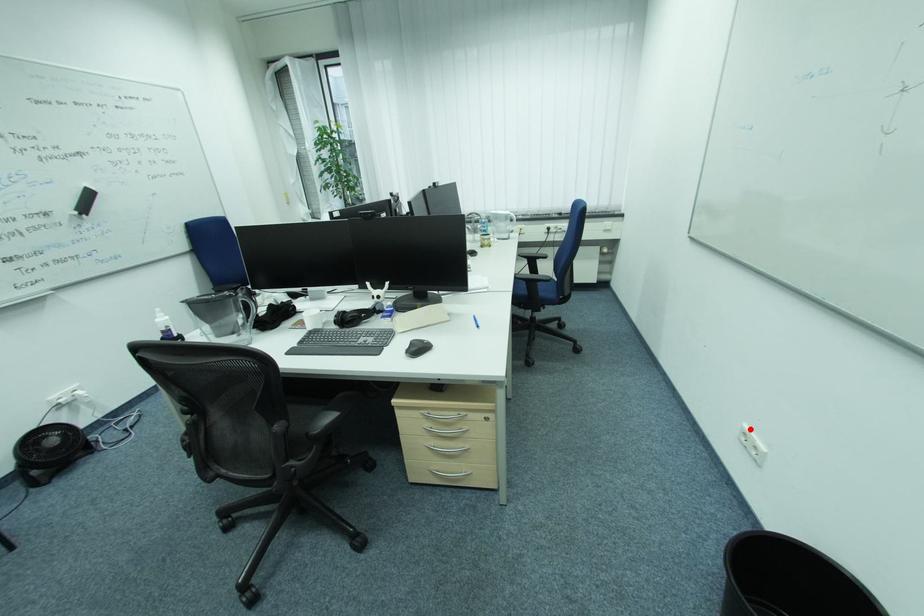
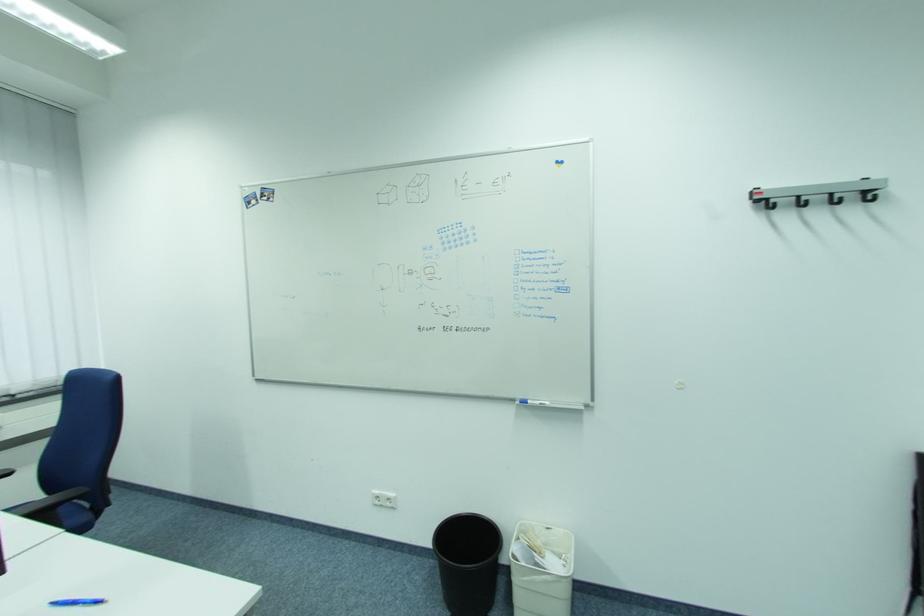
Find the pixel in the second image that matches the highlighted location in the first image.

(380, 496)